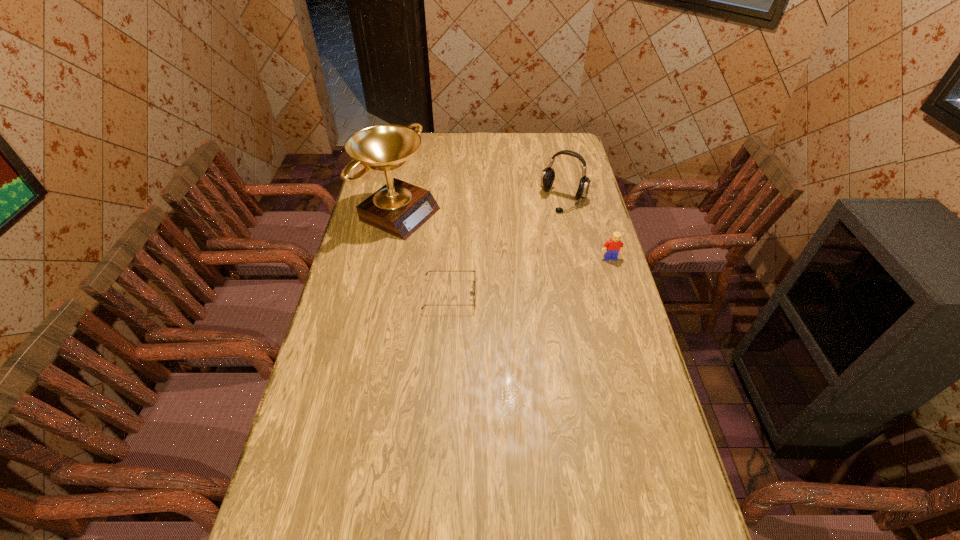
Where is `free region at the right edge`? This screenshot has width=960, height=540. free region at the right edge is located at coordinates (587, 261).

This screenshot has width=960, height=540. What are the coordinates of `free space at the near left corner` in the screenshot? It's located at (318, 508).

Identify the location of vacant area at the near right corner. pos(664,494).

Where is `free space that is in between the sunglasses and the second nearest object`? free space that is in between the sunglasses and the second nearest object is located at coordinates (x=530, y=276).

At what (x,y) coordinates should I click in order to perform the action: click on vacant space that is in between the sunglasses and the second nearest object. Please return your answer as a coordinate pair (x, y). Looking at the image, I should click on (530, 276).

What are the coordinates of `empty space that is in between the second shortest object and the award` in the screenshot? It's located at (506, 235).

At what (x,y) coordinates should I click in order to perform the action: click on empty space that is in between the third shortest object and the third farthest object. Please return your answer as a coordinate pair (x, y). Image resolution: width=960 pixels, height=540 pixels. Looking at the image, I should click on (587, 229).

In order to click on vacant area that lies between the Lego and the nearest object in this screenshot , I will do `click(530, 276)`.

Identify the location of vacant space that is in between the Lego and the nearest object. [530, 276].

Locate an element on the screen. blank region between the award and the sunglasses is located at coordinates (425, 253).